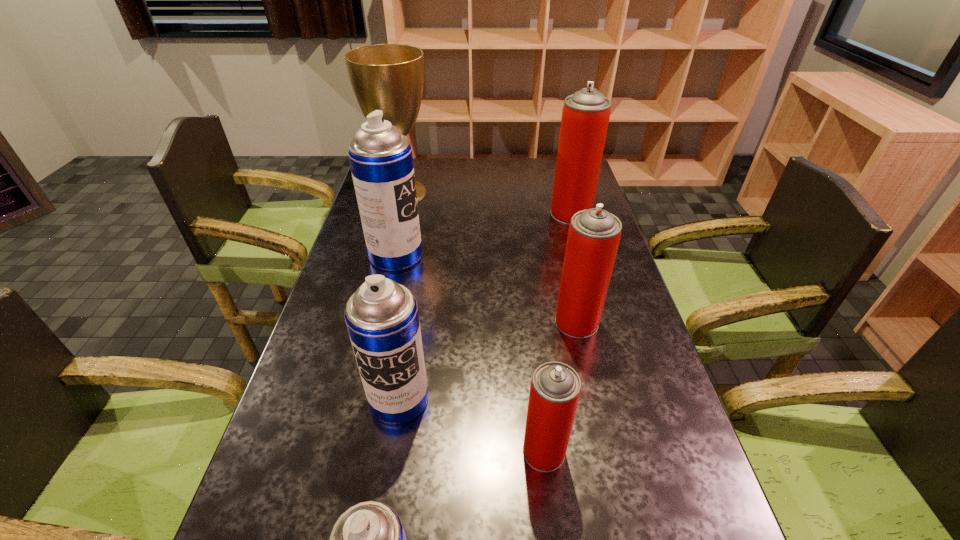
The height and width of the screenshot is (540, 960). Identify the location of object that stands as the sixth closest to the second biggest red aerosol can. (389, 77).

Locate an element on the screen. The width and height of the screenshot is (960, 540). the fifth closest aerosol can to the nearest object is located at coordinates (585, 116).

Find the location of a particular element. This screenshot has height=540, width=960. aerosol can that is the closest to the third object from right to left is located at coordinates [382, 318].

Find the location of a particular element. The image size is (960, 540). blue aerosol can that is the closest to the second nearest aerosol can is located at coordinates (382, 318).

Identify which blue aerosol can is the closest to the nearest object. Please provide its 2D coordinates. Your answer should be formatted as a tuple, i.e. [(x, y)], where the tuple contains the x and y coordinates of a point satisfying the conditions above.

[(382, 318)]

Locate an element on the screen. red aerosol can that is the closest to the second biggest blue aerosol can is located at coordinates click(x=555, y=389).

Find the location of a particular element. The width and height of the screenshot is (960, 540). red aerosol can that is the third nearest to the trophy cup is located at coordinates (555, 389).

I want to click on free spot that satisfies the following two spatial constraints: 1. on the front side of the smallest red aerosol can; 2. on the right side of the trophy cup, so click(x=334, y=451).

Locate an element on the screen. The image size is (960, 540). blank area in the image that satisfies the following two spatial constraints: 1. on the label side of the fifth farthest object; 2. on the left side of the smallest red aerosol can is located at coordinates (391, 451).

The image size is (960, 540). I want to click on vacant space that satisfies the following two spatial constraints: 1. on the front side of the sixth farthest object; 2. on the right side of the trophy cup, so click(334, 451).